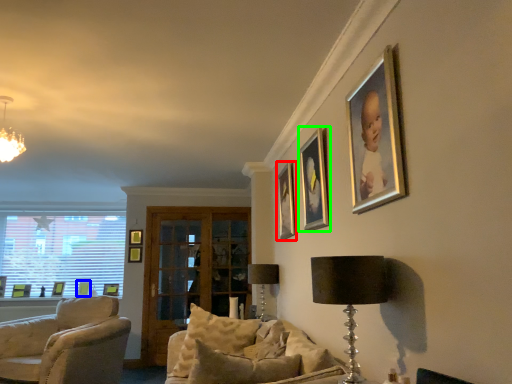
Question: Based on their relative distances, which object is farther from picture frame (highlighted by a red box)? Choose from picture frame (highlighted by a blue box) and picture frame (highlighted by a green box).

Choices:
 (A) picture frame
 (B) picture frame

Answer: (A)